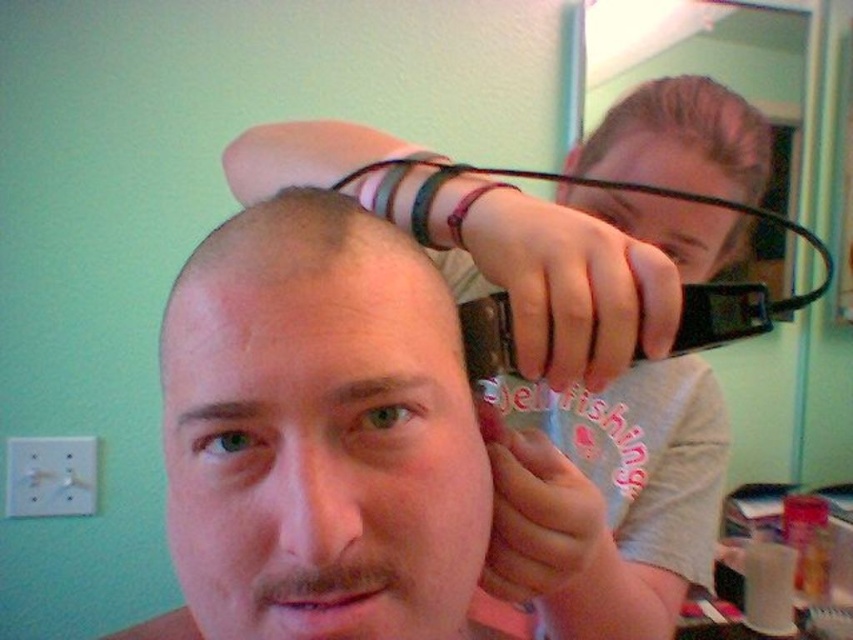
You are a stylist observing a client and a barber in a bathroom. The client has a smooth skin head at center, and the barber has slicked brown hair at upper center. Which part of their heads is taller?

The smooth skin head at center is taller than slicked brown hair at upper center.

You are a hair stylist trying to adjust the distance between the matte black hair clipper at upper center and the slicked brown hair at upper center to ensure a precise cut. Based on the current distance, can you safely make adjustments without moving either object?

The matte black hair clipper at upper center and slicked brown hair at upper center are 3.63 inches apart. Since this distance is sufficient for precise adjustments without needing to move either object, you can safely make the necessary changes.

You are a photographer taking a portrait of the person with the smooth skin head at center and the slicked brown hair at upper center. Which of the two objects takes up more space in the photo?

The slicked brown hair at upper center takes up more space in the photo because the smooth skin head at center occupies less space than slicked brown hair at upper center.